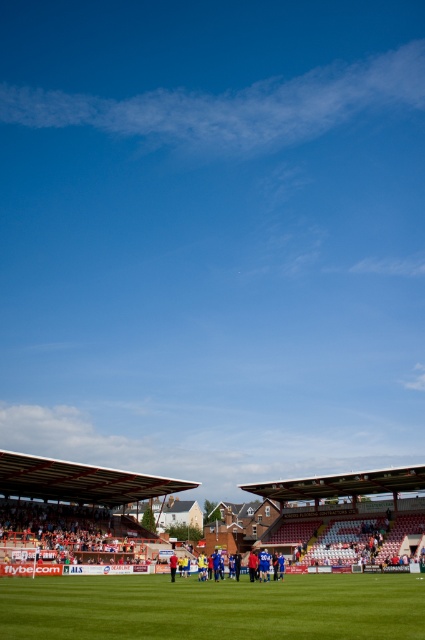
Question: Among these objects, which one is nearest to the camera?

Choices:
 (A) blue fabric football team at center
 (B) green grass football field at center

Answer: (B)

Question: Does green grass football field at center have a larger size compared to blue fabric football team at center?

Choices:
 (A) no
 (B) yes

Answer: (B)

Question: Does green grass football field at center appear over blue fabric football team at center?

Choices:
 (A) no
 (B) yes

Answer: (B)

Question: Does green grass football field at center come behind blue fabric football team at center?

Choices:
 (A) no
 (B) yes

Answer: (A)

Question: Which point is farther to the camera?

Choices:
 (A) click(178, 561)
 (B) click(337, 588)

Answer: (A)